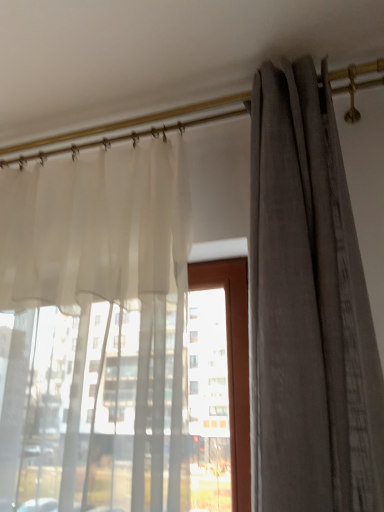
Question: Considering the positions of gray textured curtain at right, which is the 1th curtain in right-to-left order, and translucent white curtain at left, placed as the first curtain when sorted from left to right, in the image, is gray textured curtain at right, which is the 1th curtain in right-to-left order, taller or shorter than translucent white curtain at left, placed as the first curtain when sorted from left to right,?

Choices:
 (A) tall
 (B) short

Answer: (A)

Question: Is point click(x=329, y=238) closer or farther from the camera than point click(x=4, y=425)?

Choices:
 (A) closer
 (B) farther

Answer: (A)

Question: From the image's perspective, is gray textured curtain at right, arranged as the 2th curtain when viewed from the left, located above or below translucent white curtain at left, placed as the 2th curtain when sorted from right to left?

Choices:
 (A) below
 (B) above

Answer: (B)

Question: From a real-world perspective, is translucent white curtain at left, placed as the first curtain when sorted from left to right, physically located above or below gray textured curtain at right, which is the 1th curtain in right-to-left order?

Choices:
 (A) above
 (B) below

Answer: (B)

Question: Is translucent white curtain at left, placed as the first curtain when sorted from left to right, in front of or behind gray textured curtain at right, which is the 1th curtain in right-to-left order, in the image?

Choices:
 (A) front
 (B) behind

Answer: (B)

Question: Is point (94, 437) closer or farther from the camera than point (296, 105)?

Choices:
 (A) farther
 (B) closer

Answer: (B)

Question: Considering the positions of translucent white curtain at left, placed as the 2th curtain when sorted from right to left, and gray textured curtain at right, which is the 1th curtain in right-to-left order, in the image, is translucent white curtain at left, placed as the 2th curtain when sorted from right to left, taller or shorter than gray textured curtain at right, which is the 1th curtain in right-to-left order,?

Choices:
 (A) tall
 (B) short

Answer: (B)